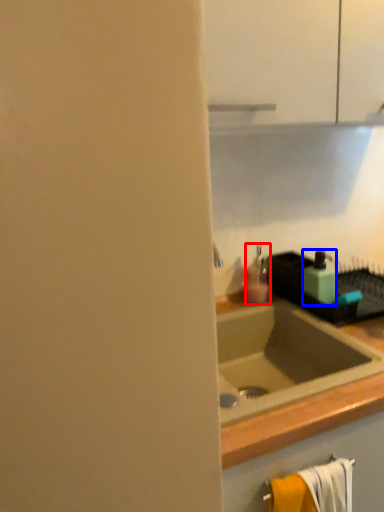
Question: Which object is further to the camera taking this photo, soap dispenser (highlighted by a red box) or soap dispenser (highlighted by a blue box)?

Choices:
 (A) soap dispenser
 (B) soap dispenser

Answer: (A)